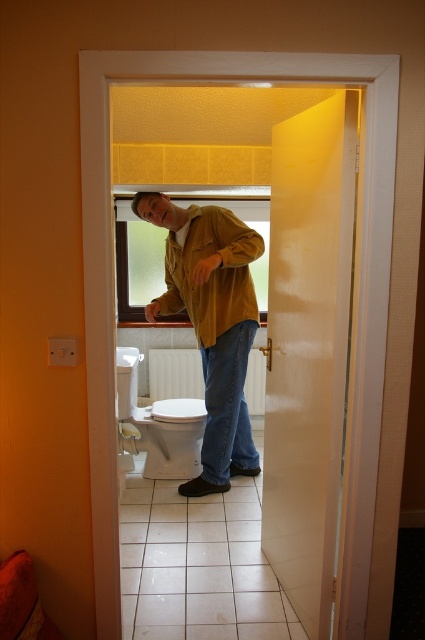
You are standing in the bathroom and need to put on your matte yellow jacket at center. The white glossy toilet bowl at center is in your way. Can you move around it to reach the jacket?

The matte yellow jacket at center is to the right of the white glossy toilet bowl at center, so you can move around the toilet bowl to the right side to reach the jacket.

You are a home inspector assessing the bathroom layout. You notice the matte yellow jacket at center and the white glossy toilet bowl at center. Which object is taller?

The matte yellow jacket at center is taller than the white glossy toilet bowl at center.